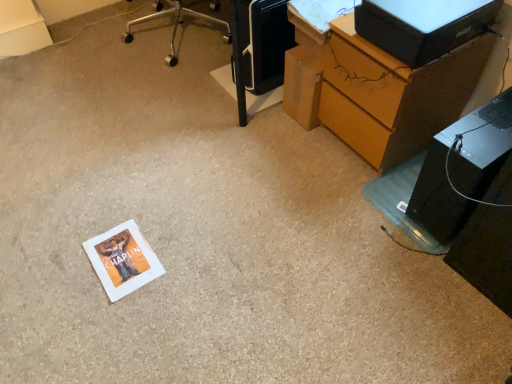
Question: Is black plastic computer tower at lower right bigger or smaller than wooden desk at lower right?

Choices:
 (A) small
 (B) big

Answer: (A)

Question: From the image's perspective, is black plastic computer tower at lower right positioned above or below wooden desk at lower right?

Choices:
 (A) below
 (B) above

Answer: (A)

Question: Estimate the real-world distances between objects in this image. Which object is farther from the black plastic computer tower at lower right?

Choices:
 (A) wooden desk at lower right
 (B) black plastic printer at upper center
 (C) black plastic desktop computer at upper right

Answer: (B)

Question: Which of these objects is positioned closest to the black plastic computer tower at lower right?

Choices:
 (A) black plastic printer at upper center
 (B) black plastic desktop computer at upper right
 (C) wooden desk at lower right

Answer: (C)